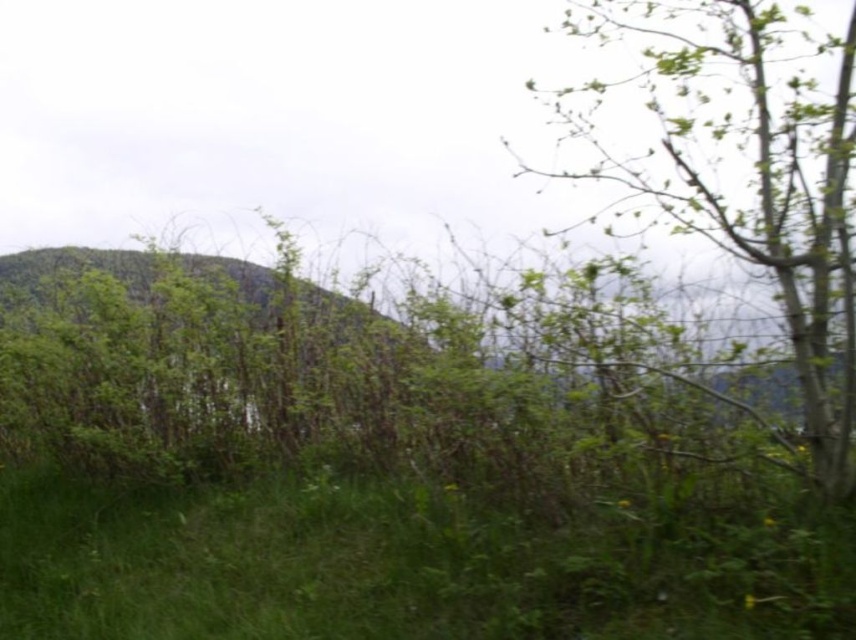
You are a gardener who wants to plant a new flower bed. You have a small flower that needs to be placed where it can get enough sunlight. Which location would be better between the green grassy at center and the green leafy tree at upper right?

The green grassy at center is not as tall as the green leafy tree at upper right, so planting the flower at the green grassy at center would provide better sunlight access since it is shorter and less likely to block the sunlight.

You are standing at the center of the image. You want to walk to the green grassy at center. Which direction should you go?

You are already at the green grassy at center, so no direction is needed.